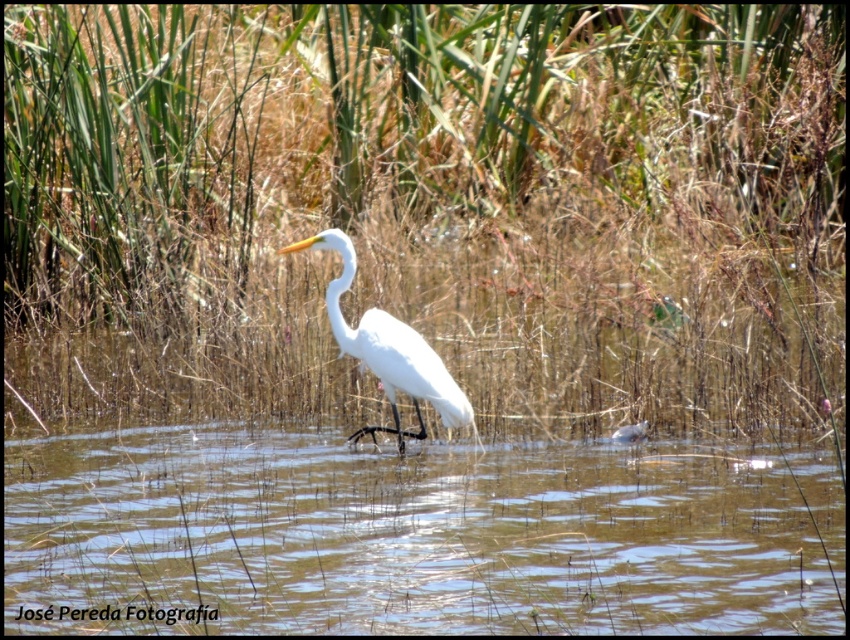
You are standing 5 meters away from the green grass at center. Can you reach it without moving closer?

The green grass at center is 5.33 meters away from the viewer, so you cannot reach it without moving closer since you are currently 5 meters away.

You are a small frog trying to jump from the green grass at center to the clear water at center. Can you safely make the jump without falling into the water?

The green grass at center might be wider than the clear water at center, so there is a chance the frog can jump safely. However, since the width comparison is uncertain, it depends on the actual distance between them.

You are a photographer trying to capture the white smooth heron at center. You notice that the clear water at center is reflecting the heron. To ensure the reflection is fully visible in your photo, should you position yourself to the left or right of the heron?

The clear water at center is to the right of the white smooth heron at center, so positioning yourself to the right of the heron would allow you to see the reflection in the water.